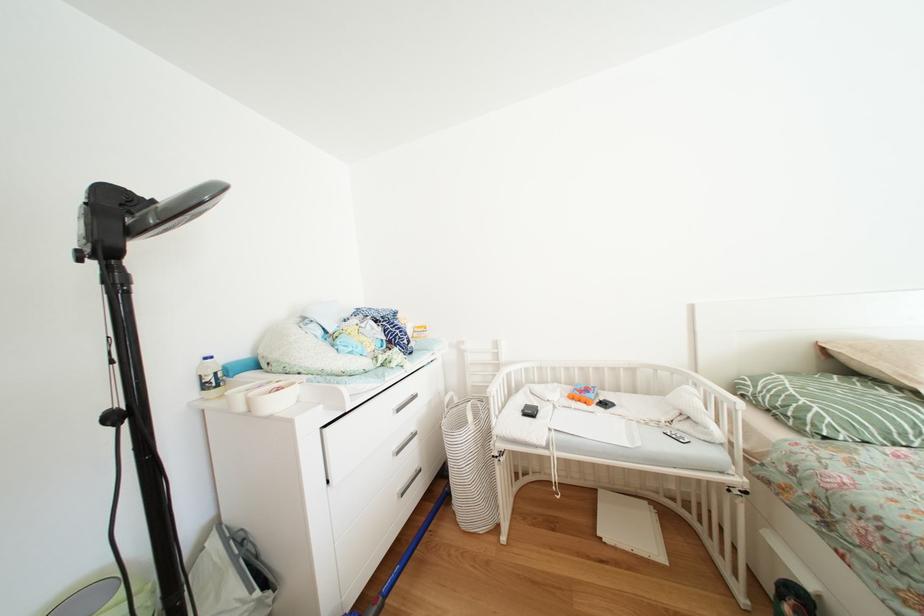
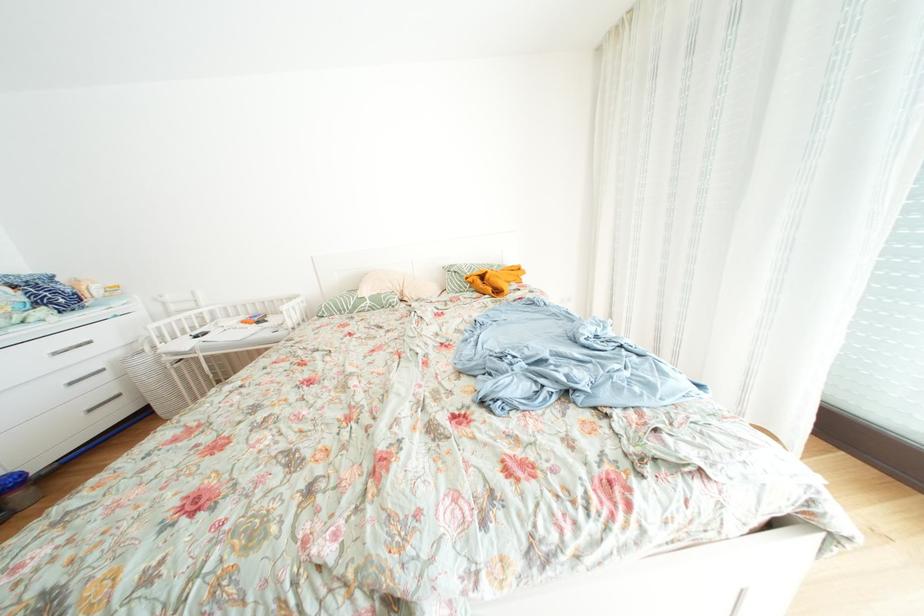
What movement of the cameraman would produce the second image?

The cameraman walked toward right, backward.